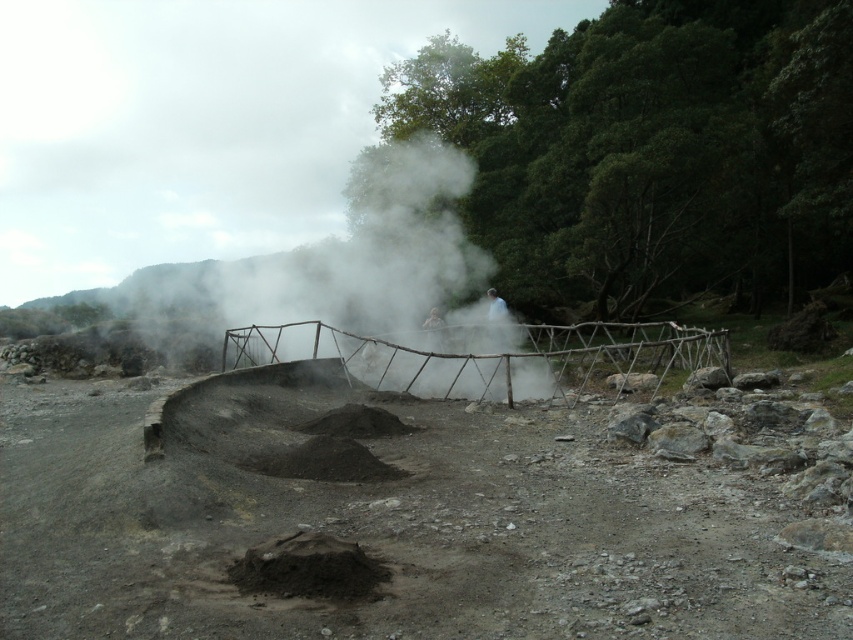
Question: Considering the relative positions of white vapor at center and wooden fence at center in the image provided, where is white vapor at center located with respect to wooden fence at center?

Choices:
 (A) below
 (B) above

Answer: (B)

Question: Which of the following is the closest to the observer?

Choices:
 (A) dull gray dirt track at center
 (B) white vapor at center
 (C) wooden fence at center
 (D) dark gray ash at center

Answer: (A)

Question: In this image, where is wooden fence at center located relative to dark gray ash at center?

Choices:
 (A) right
 (B) left

Answer: (A)

Question: Which is nearer to the dull gray dirt track at center?

Choices:
 (A) wooden fence at center
 (B) white vapor at center
 (C) dark gray ash at center

Answer: (C)

Question: Does wooden fence at center appear over dark gray ash at center?

Choices:
 (A) yes
 (B) no

Answer: (A)

Question: Which point is closer to the camera?

Choices:
 (A) white vapor at center
 (B) dark gray ash at center
 (C) dull gray dirt track at center
 (D) wooden fence at center

Answer: (C)